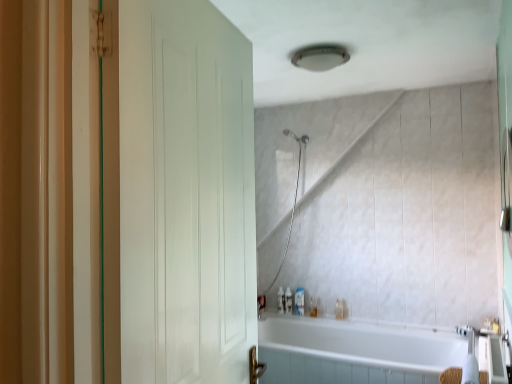
What do you see at coordinates (281, 300) in the screenshot? This screenshot has height=384, width=512. I see `translucent plastic soap dispenser at lower center, positioned as the second toiletry in left-to-right order` at bounding box center [281, 300].

How much space does translucent plastic bottle at lower center, the 1th toiletry positioned from the right, occupy vertically?

The height of translucent plastic bottle at lower center, the 1th toiletry positioned from the right, is 6.47 inches.

This screenshot has height=384, width=512. What do you see at coordinates (339, 309) in the screenshot?
I see `translucent plastic bottle at lower center, positioned as the sixth toiletry in left-to-right order` at bounding box center [339, 309].

Identify the location of white glossy faucet at lower right. The image size is (512, 384). (496, 360).

How much space does translucent plastic bottle at lower center, placed as the first toiletry when sorted from left to right, occupy vertically?

The height of translucent plastic bottle at lower center, placed as the first toiletry when sorted from left to right, is 5.17 inches.

Locate an element on the screen. This screenshot has height=384, width=512. translucent plastic soap dispenser at lower center, the fourth toiletry positioned from the right is located at coordinates (288, 300).

Is translucent plastic bottle at lower center, the 1th toiletry positioned from the right, oriented towards white matte door at left?

Yes, translucent plastic bottle at lower center, the 1th toiletry positioned from the right, is oriented towards white matte door at left.

Considering the positions of points (341, 309) and (153, 209), is point (341, 309) closer to camera compared to point (153, 209)?

No, it is behind (153, 209).

Would you say white matte door at left is part of translucent plastic bottle at lower center, positioned as the sixth toiletry in left-to-right order,'s contents?

Definitely not — white matte door at left is not inside translucent plastic bottle at lower center, positioned as the sixth toiletry in left-to-right order.

Considering the sizes of translucent plastic soap dispenser at lower center, arranged as the 3th toiletry when viewed from the left, and white glossy faucet at lower right in the image, is translucent plastic soap dispenser at lower center, arranged as the 3th toiletry when viewed from the left, taller or shorter than white glossy faucet at lower right?

In the image, translucent plastic soap dispenser at lower center, arranged as the 3th toiletry when viewed from the left, appears to be shorter than white glossy faucet at lower right.

Where is `faucet located above the translucent plastic soap dispenser at lower center, the fourth toiletry positioned from the right (from the image's perspective)`? faucet located above the translucent plastic soap dispenser at lower center, the fourth toiletry positioned from the right (from the image's perspective) is located at coordinates (x=496, y=360).

Could you tell me if translucent plastic soap dispenser at lower center, the fourth toiletry positioned from the right, is facing white glossy faucet at lower right?

No, translucent plastic soap dispenser at lower center, the fourth toiletry positioned from the right, is not facing towards white glossy faucet at lower right.

Between point (289, 305) and point (471, 336), which one is positioned in front?

The point (471, 336) is more forward.

Locate an element on the screen. This screenshot has height=384, width=512. the 1st toiletry to the left of the translucent plastic soap dispenser at lower center, the fourth toiletry positioned from the right, counting from the anchor's position is located at coordinates (281, 300).

Could you tell me if translucent plastic soap dispenser at lower center, positioned as the second toiletry in left-to-right order, is turned towards translucent plastic soap dispenser at lower center, the fourth toiletry positioned from the right?

No, translucent plastic soap dispenser at lower center, positioned as the second toiletry in left-to-right order, does not turn towards translucent plastic soap dispenser at lower center, the fourth toiletry positioned from the right.

Is translucent plastic soap dispenser at lower center, arranged as the 3th toiletry when viewed from the left, located within translucent plastic soap dispenser at lower center, placed as the fifth toiletry when sorted from right to left?

That's incorrect, translucent plastic soap dispenser at lower center, arranged as the 3th toiletry when viewed from the left, is not inside translucent plastic soap dispenser at lower center, placed as the fifth toiletry when sorted from right to left.

Can you confirm if white glossy faucet at lower right is bigger than translucent plastic soap dispenser at lower center, which ranks as the third toiletry in right-to-left order?

Yes, white glossy faucet at lower right is bigger than translucent plastic soap dispenser at lower center, which ranks as the third toiletry in right-to-left order.

Is point (474, 349) positioned behind point (294, 299)?

That is False.

Consider the image. Which is correct: white glossy faucet at lower right is inside translucent plastic soap dispenser at lower center, which ranks as the third toiletry in right-to-left order, or outside of it?

white glossy faucet at lower right is not inside translucent plastic soap dispenser at lower center, which ranks as the third toiletry in right-to-left order, it's outside.

From the image's perspective, which object appears higher, white glossy faucet at lower right or translucent plastic soap dispenser at lower center, which is the fourth toiletry in left-to-right order?

white glossy faucet at lower right, from the image's perspective.

Who is shorter, translucent plastic soap dispenser at lower center, arranged as the 3th toiletry when viewed from the left, or translucent plastic bottle at lower center, positioned as the sixth toiletry in left-to-right order?

translucent plastic bottle at lower center, positioned as the sixth toiletry in left-to-right order.

Which object is further away from the camera, translucent plastic soap dispenser at lower center, the fourth toiletry positioned from the right, or translucent plastic bottle at lower center, the 1th toiletry positioned from the right?

translucent plastic soap dispenser at lower center, the fourth toiletry positioned from the right.

Is translucent plastic soap dispenser at lower center, arranged as the 3th toiletry when viewed from the left, oriented away from translucent plastic bottle at lower center, positioned as the sixth toiletry in left-to-right order?

translucent plastic soap dispenser at lower center, arranged as the 3th toiletry when viewed from the left, does not have its back to translucent plastic bottle at lower center, positioned as the sixth toiletry in left-to-right order.

Is translucent plastic soap at lower center, positioned as the fifth toiletry in left-to-right order, facing towards translucent plastic bottle at lower center, the 1th toiletry positioned from the right?

No, translucent plastic soap at lower center, positioned as the fifth toiletry in left-to-right order, is not oriented towards translucent plastic bottle at lower center, the 1th toiletry positioned from the right.

Considering the sizes of objects translucent plastic soap at lower center, which appears as the 2th toiletry when viewed from the right, and translucent plastic bottle at lower center, positioned as the sixth toiletry in left-to-right order, in the image provided, who is smaller, translucent plastic soap at lower center, which appears as the 2th toiletry when viewed from the right, or translucent plastic bottle at lower center, positioned as the sixth toiletry in left-to-right order,?

Smaller between the two is translucent plastic bottle at lower center, positioned as the sixth toiletry in left-to-right order.

From the image's perspective, is translucent plastic soap at lower center, which appears as the 2th toiletry when viewed from the right, positioned above or below translucent plastic bottle at lower center, positioned as the sixth toiletry in left-to-right order?

translucent plastic soap at lower center, which appears as the 2th toiletry when viewed from the right, is situated lower than translucent plastic bottle at lower center, positioned as the sixth toiletry in left-to-right order, in the image.

Which is in front, point (310, 313) or point (340, 319)?

The point (340, 319) is in front.

From the image's perspective, starting from the white glossy bathtub at lower center, which toiletry is the 5th one above? Please provide its 2D coordinates.

[(288, 300)]

Considering the sizes of objects translucent plastic soap dispenser at lower center, the fourth toiletry positioned from the right, and white glossy bathtub at lower center in the image provided, who is shorter, translucent plastic soap dispenser at lower center, the fourth toiletry positioned from the right, or white glossy bathtub at lower center?

translucent plastic soap dispenser at lower center, the fourth toiletry positioned from the right, is shorter.

Would you say translucent plastic soap dispenser at lower center, the fourth toiletry positioned from the right, is to the left or to the right of white glossy bathtub at lower center in the picture?

Based on their positions, translucent plastic soap dispenser at lower center, the fourth toiletry positioned from the right, is located to the left of white glossy bathtub at lower center.

Where is `door on the left of translucent plastic bottle at lower center, positioned as the sixth toiletry in left-to-right order`? This screenshot has width=512, height=384. door on the left of translucent plastic bottle at lower center, positioned as the sixth toiletry in left-to-right order is located at coordinates (177, 194).

From the image's perspective, starting from the white glossy faucet at lower right, which toiletry is the 2nd one below? Please provide its 2D coordinates.

[(288, 300)]

When comparing their distances from translucent plastic soap dispenser at lower center, positioned as the second toiletry in left-to-right order, does translucent plastic bottle at lower center, placed as the 6th toiletry when sorted from right to left, or white glossy faucet at lower right seem further?

Based on the image, white glossy faucet at lower right appears to be further to translucent plastic soap dispenser at lower center, positioned as the second toiletry in left-to-right order.

Based on their spatial positions, is translucent plastic bottle at lower center, positioned as the sixth toiletry in left-to-right order, or white glossy bathtub at lower center further from translucent plastic soap dispenser at lower center, the fourth toiletry positioned from the right?

The object further to translucent plastic soap dispenser at lower center, the fourth toiletry positioned from the right, is white glossy bathtub at lower center.

Estimate the real-world distances between objects in this image. Which object is further from white glossy faucet at lower right, translucent plastic soap at lower center, positioned as the fifth toiletry in left-to-right order, or white glossy bathtub at lower center?

translucent plastic soap at lower center, positioned as the fifth toiletry in left-to-right order.

Estimate the real-world distances between objects in this image. Which object is closer to white glossy bathtub at lower center, translucent plastic soap dispenser at lower center, arranged as the 3th toiletry when viewed from the left, or translucent plastic soap dispenser at lower center, positioned as the second toiletry in left-to-right order?

translucent plastic soap dispenser at lower center, arranged as the 3th toiletry when viewed from the left, lies closer to white glossy bathtub at lower center than the other object.

Consider the image. Which object lies further to the anchor point translucent plastic soap dispenser at lower center, arranged as the 3th toiletry when viewed from the left, white glossy faucet at lower right or translucent plastic bottle at lower center, the 1th toiletry positioned from the right?

white glossy faucet at lower right lies further to translucent plastic soap dispenser at lower center, arranged as the 3th toiletry when viewed from the left, than the other object.

Considering their positions, is translucent plastic soap dispenser at lower center, the fourth toiletry positioned from the right, positioned closer to translucent plastic bottle at lower center, placed as the first toiletry when sorted from left to right, than white glossy faucet at lower right?

translucent plastic soap dispenser at lower center, the fourth toiletry positioned from the right, is positioned closer to the anchor translucent plastic bottle at lower center, placed as the first toiletry when sorted from left to right.

Based on their spatial positions, is translucent plastic soap dispenser at lower center, placed as the fifth toiletry when sorted from right to left, or white glossy bathtub at lower center closer to translucent plastic soap at lower center, positioned as the fifth toiletry in left-to-right order?

Among the two, translucent plastic soap dispenser at lower center, placed as the fifth toiletry when sorted from right to left, is located nearer to translucent plastic soap at lower center, positioned as the fifth toiletry in left-to-right order.

Considering their positions, is translucent plastic soap dispenser at lower center, arranged as the 3th toiletry when viewed from the left, positioned closer to white glossy faucet at lower right than translucent plastic soap dispenser at lower center, positioned as the second toiletry in left-to-right order?

translucent plastic soap dispenser at lower center, arranged as the 3th toiletry when viewed from the left, is closer to white glossy faucet at lower right.

Find the location of a particular element. This screenshot has height=384, width=512. bathtub between white matte door at left and translucent plastic soap dispenser at lower center, arranged as the 3th toiletry when viewed from the left, along the z-axis is located at coordinates (353, 352).

Where is `bathtub between white matte door at left and translucent plastic bottle at lower center, placed as the 6th toiletry when sorted from right to left, from front to back`? bathtub between white matte door at left and translucent plastic bottle at lower center, placed as the 6th toiletry when sorted from right to left, from front to back is located at coordinates (353, 352).

Where is `toiletry between translucent plastic soap dispenser at lower center, which is the fourth toiletry in left-to-right order, and translucent plastic bottle at lower center, positioned as the sixth toiletry in left-to-right order, in the horizontal direction`? toiletry between translucent plastic soap dispenser at lower center, which is the fourth toiletry in left-to-right order, and translucent plastic bottle at lower center, positioned as the sixth toiletry in left-to-right order, in the horizontal direction is located at coordinates (313, 307).

I want to click on bathtub between white glossy faucet at lower right and translucent plastic soap dispenser at lower center, arranged as the 3th toiletry when viewed from the left, in the front-back direction, so click(353, 352).